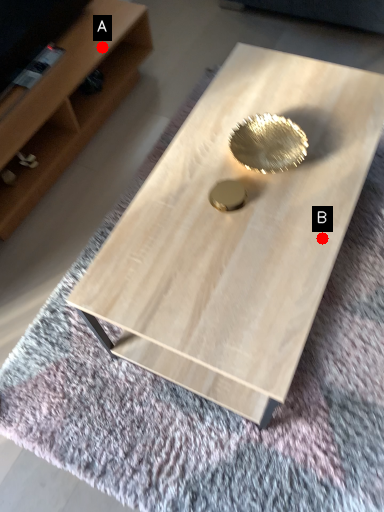
Question: Two points are circled on the image, labeled by A and B beside each circle. Which point appears closest to the camera in this image?

Choices:
 (A) A is closer
 (B) B is closer

Answer: (B)